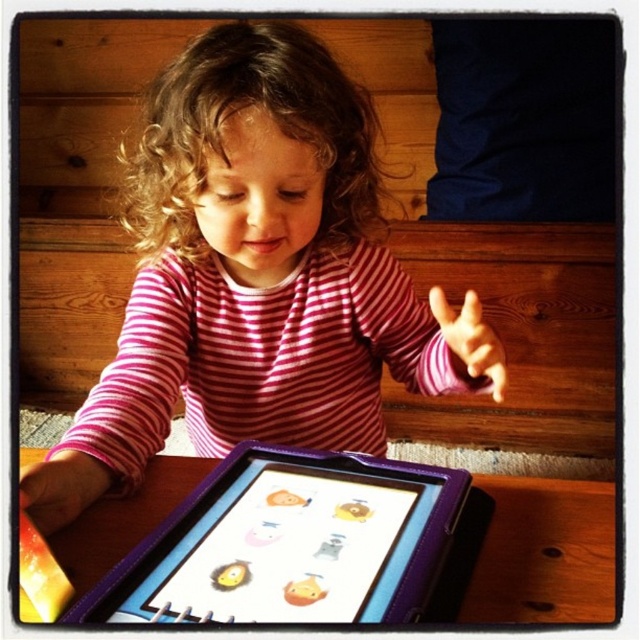
You are a photographer trying to capture a closeup of the tablet screen. You notice two points in the image labeled as point (230, 198) and point (486, 372). Which point should you focus on to ensure the tablet screen is in focus?

Point (230, 198) is closer to the viewer than point (486, 372), so focusing on point (230, 198) will ensure the tablet screen is in focus.

You are a photographer trying to capture a closeup of the pink striped shirt at center. The camera you are using has a minimum focusing distance of 20 inches. Can you take the photo without moving the camera or the shirt?

The pink striped shirt at center and camera are 22.07 inches apart from each other, so yes, you can take the photo since the distance is within the camera minimum focusing distance of 20 inches.

You are a photographer trying to capture a closeup shot of the tablet screen. You notice the pink striped shirt at center and the pink fabric hand at center might block the view. Which object should you move to get a clearer view of the tablet?

The pink striped shirt at center is larger in size than the pink fabric hand at center, so you should move the pink striped shirt at center to get a clearer view of the tablet.